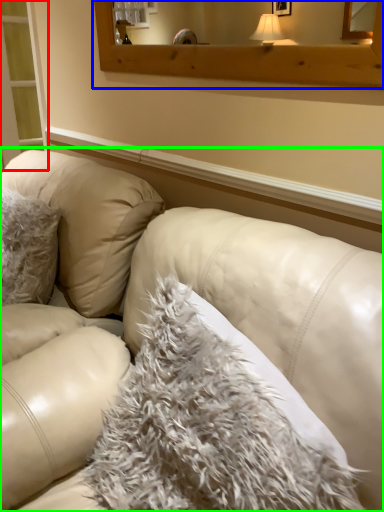
Question: Which is nearer to the screen door (highlighted by a red box)? window frame (highlighted by a blue box) or studio couch (highlighted by a green box).

Choices:
 (A) window frame
 (B) studio couch

Answer: (A)